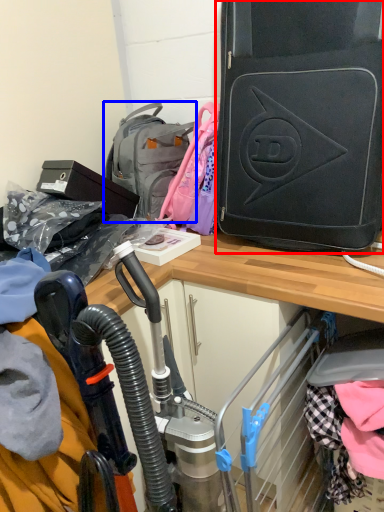
Question: Which point is further to the camera, luggage and bags (highlighted by a red box) or backpack (highlighted by a blue box)?

Choices:
 (A) luggage and bags
 (B) backpack

Answer: (B)